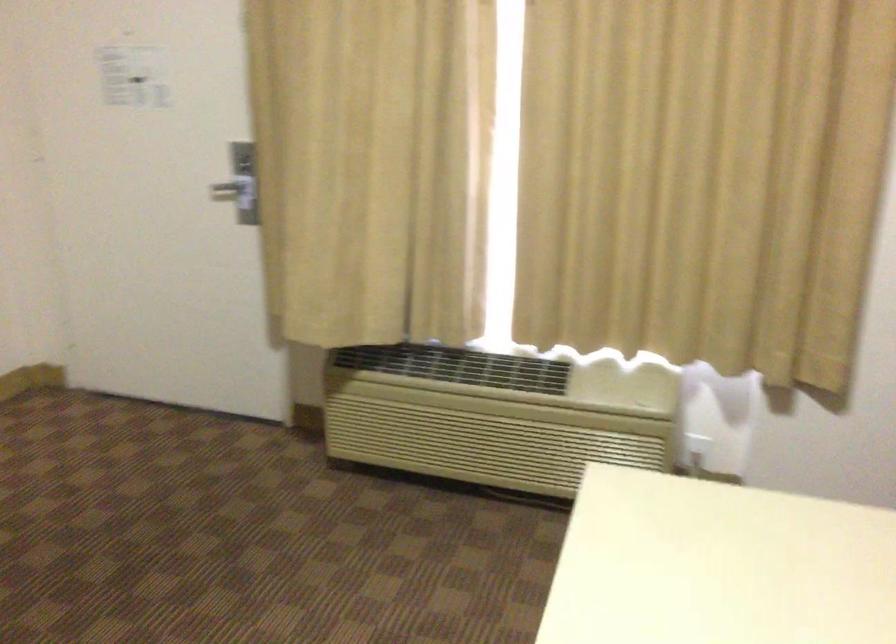
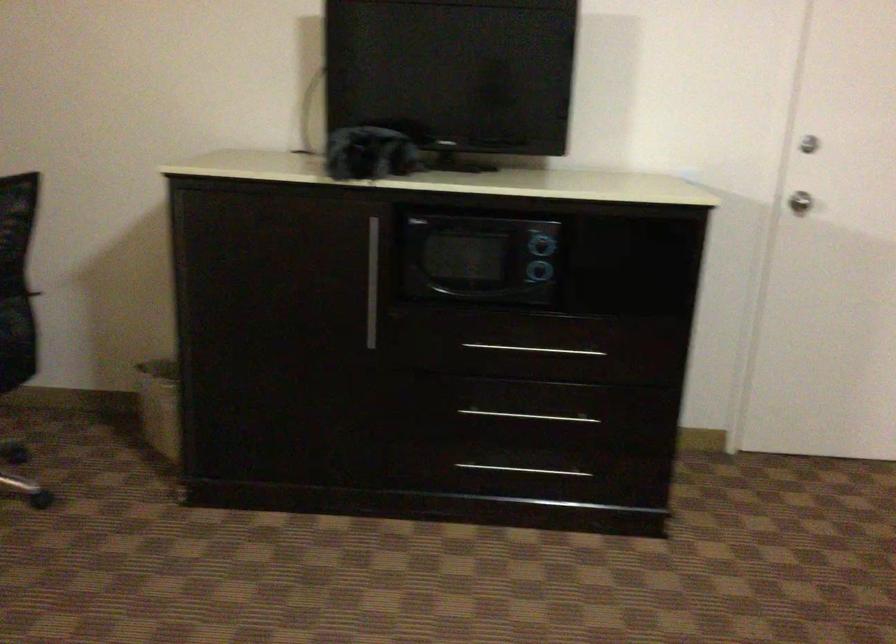
Question: The images are taken continuously from a first-person perspective. In which direction is your viewpoint rotating?

Choices:
 (A) Left
 (B) Right
 (C) Up
 (D) Down

Answer: (A)